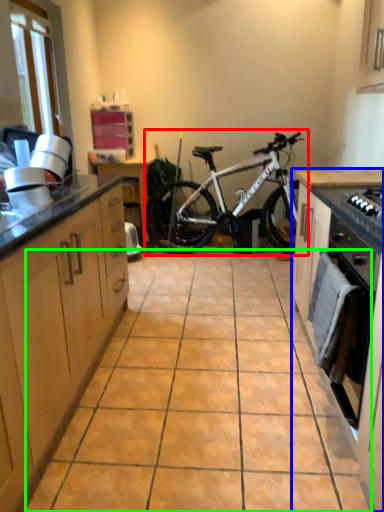
Question: Estimate the real-world distances between objects in this image. Which object is farther from bicycle (highlighted by a red box), cabinetry (highlighted by a blue box) or ceramic tile (highlighted by a green box)?

Choices:
 (A) cabinetry
 (B) ceramic tile

Answer: (B)